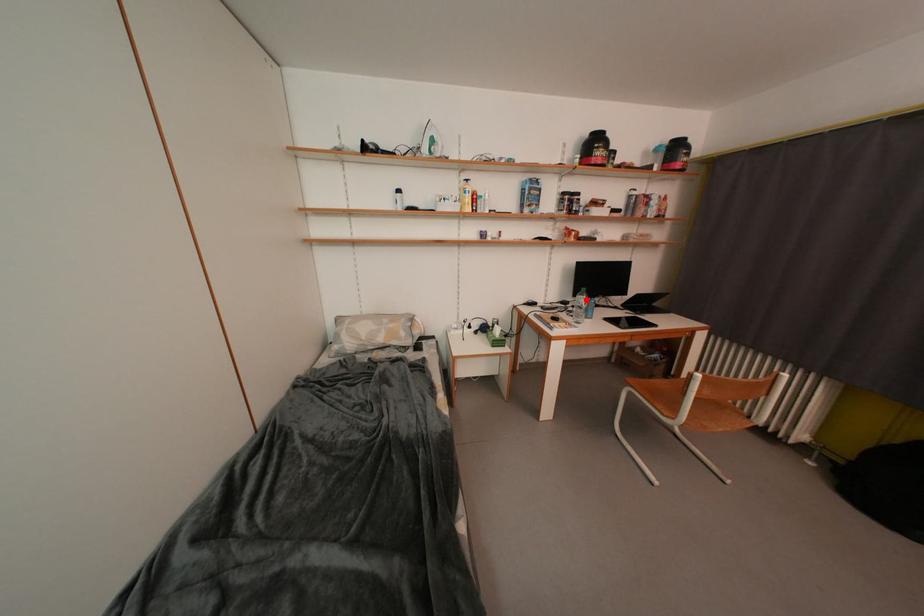
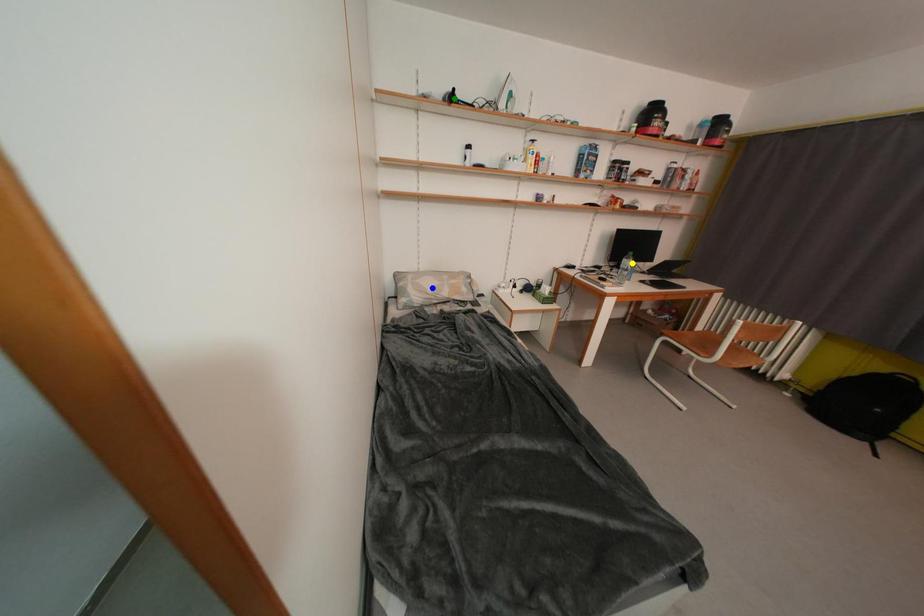
Question: I am providing you with two images of the same scene from different viewpoints. A red point is marked on the first image. You are given multiple points on the second image. In image 2, which mark is for the same physical point as the one in image 1?

Choices:
 (A) green point
 (B) yellow point
 (C) blue point

Answer: (B)